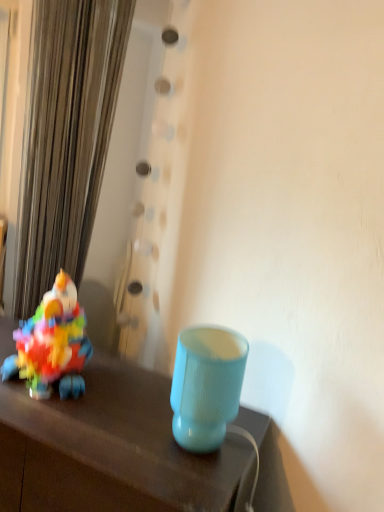
Question: Is matte blue lampshade at center a part of multicolored plastic toy at left?

Choices:
 (A) yes
 (B) no

Answer: (B)

Question: Can you confirm if multicolored plastic toy at left is positioned to the right of matte blue lampshade at center?

Choices:
 (A) yes
 (B) no

Answer: (B)

Question: From a real-world perspective, is multicolored plastic toy at left on top of matte blue lampshade at center?

Choices:
 (A) yes
 (B) no

Answer: (A)

Question: Is multicolored plastic toy at left not inside matte blue lampshade at center?

Choices:
 (A) yes
 (B) no

Answer: (A)

Question: Does multicolored plastic toy at left have a larger size compared to matte blue lampshade at center?

Choices:
 (A) no
 (B) yes

Answer: (B)

Question: Considering the positions of multicolored plastic toy at left and matte plastic lamp at lower right in the image, is multicolored plastic toy at left bigger or smaller than matte plastic lamp at lower right?

Choices:
 (A) small
 (B) big

Answer: (A)

Question: Looking at their shapes, would you say multicolored plastic toy at left is wider or thinner than matte plastic lamp at lower right?

Choices:
 (A) wide
 (B) thin

Answer: (B)

Question: From a real-world perspective, is multicolored plastic toy at left positioned above or below matte plastic lamp at lower right?

Choices:
 (A) below
 (B) above

Answer: (B)

Question: Does point (18, 348) appear closer or farther from the camera than point (109, 388)?

Choices:
 (A) farther
 (B) closer

Answer: (B)

Question: From a real-world perspective, is matte blue lampshade at center physically located above or below metallic silver curtain at left?

Choices:
 (A) below
 (B) above

Answer: (A)

Question: Is matte blue lampshade at center inside the boundaries of metallic silver curtain at left, or outside?

Choices:
 (A) inside
 (B) outside

Answer: (B)

Question: In the image, is matte blue lampshade at center on the left side or the right side of metallic silver curtain at left?

Choices:
 (A) right
 (B) left

Answer: (A)

Question: Looking at the image, does matte blue lampshade at center seem bigger or smaller compared to metallic silver curtain at left?

Choices:
 (A) big
 (B) small

Answer: (B)

Question: Is metallic silver curtain at left inside the boundaries of multicolored plastic toy at left, or outside?

Choices:
 (A) inside
 (B) outside

Answer: (B)

Question: Considering their positions, is metallic silver curtain at left located in front of or behind multicolored plastic toy at left?

Choices:
 (A) front
 (B) behind

Answer: (B)